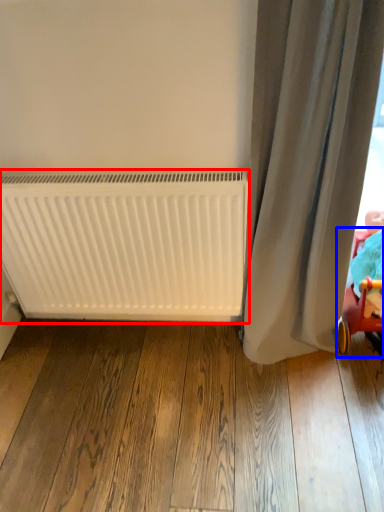
Question: Which point is further to the camera, radiator (highlighted by a red box) or baby carriage (highlighted by a blue box)?

Choices:
 (A) radiator
 (B) baby carriage

Answer: (A)